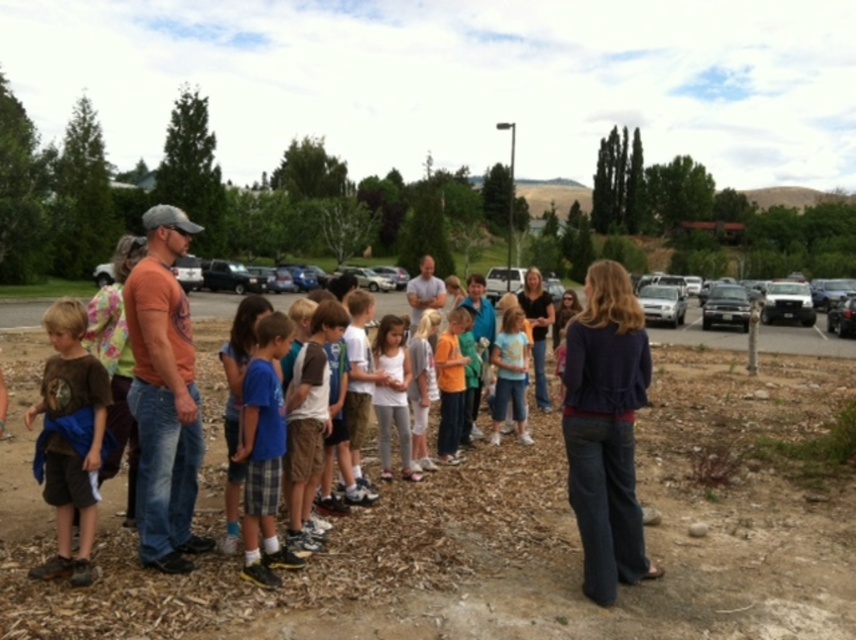
Is silver metallic suv at right behind silver metallic sedan at center?

→ Yes.

Does point (764, 294) come farther from viewer compared to point (670, 321)?

Yes, point (764, 294) is behind point (670, 321).

Where is `silver metallic suv at right`? The image size is (856, 640). silver metallic suv at right is located at coordinates (788, 301).

Does silver metallic suv at right have a lesser width compared to metallic silver car at right?

In fact, silver metallic suv at right might be wider than metallic silver car at right.

This screenshot has height=640, width=856. What are the coordinates of `silver metallic suv at right` in the screenshot? It's located at (788, 301).

Does brown cotton shirt at lower left lie in front of silver metallic sedan at right?

Yes.

Is point (46, 470) farther from viewer compared to point (789, 291)?

That is False.

Where is `brown cotton shirt at lower left`? The height and width of the screenshot is (640, 856). brown cotton shirt at lower left is located at coordinates (70, 440).